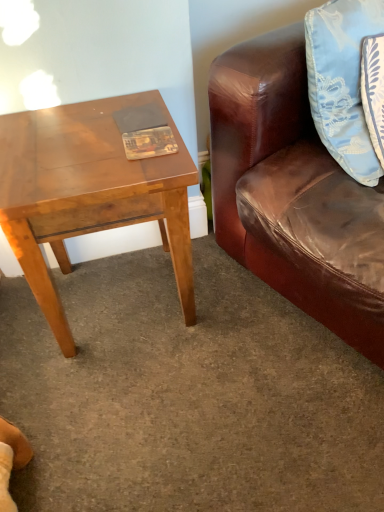
Question: Is matte plastic book at center located outside light brown wooden table at left?

Choices:
 (A) no
 (B) yes

Answer: (A)

Question: Does matte plastic book at center have a lesser height compared to light brown wooden table at left?

Choices:
 (A) no
 (B) yes

Answer: (B)

Question: Is matte plastic book at center next to light brown wooden table at left and touching it?

Choices:
 (A) yes
 (B) no

Answer: (B)

Question: Is matte plastic book at center further to the viewer compared to light brown wooden table at left?

Choices:
 (A) yes
 (B) no

Answer: (A)

Question: From a real-world perspective, is matte plastic book at center beneath light brown wooden table at left?

Choices:
 (A) no
 (B) yes

Answer: (A)

Question: From the image's perspective, relative to light brown wooden table at left, is matte plastic book at center above or below?

Choices:
 (A) above
 (B) below

Answer: (A)

Question: Is matte plastic book at center bigger or smaller than light brown wooden table at left?

Choices:
 (A) small
 (B) big

Answer: (A)

Question: Is matte plastic book at center wider or thinner than light brown wooden table at left?

Choices:
 (A) wide
 (B) thin

Answer: (B)

Question: Is matte plastic book at center inside the boundaries of light brown wooden table at left, or outside?

Choices:
 (A) outside
 (B) inside

Answer: (B)

Question: Considering the positions of light brown wooden table at left and light blue satin pillow at upper right in the image, is light brown wooden table at left wider or thinner than light blue satin pillow at upper right?

Choices:
 (A) thin
 (B) wide

Answer: (B)

Question: Which is correct: light brown wooden table at left is inside light blue satin pillow at upper right, or outside of it?

Choices:
 (A) inside
 (B) outside

Answer: (B)

Question: In the image, is light brown wooden table at left on the left side or the right side of light blue satin pillow at upper right?

Choices:
 (A) left
 (B) right

Answer: (A)

Question: Is light brown wooden table at left in front of or behind light blue satin pillow at upper right in the image?

Choices:
 (A) front
 (B) behind

Answer: (B)

Question: From a real-world perspective, relative to matte plastic book at center, is light brown wooden table at left vertically above or below?

Choices:
 (A) above
 (B) below

Answer: (B)

Question: Is light brown wooden table at left bigger or smaller than matte plastic book at center?

Choices:
 (A) small
 (B) big

Answer: (B)